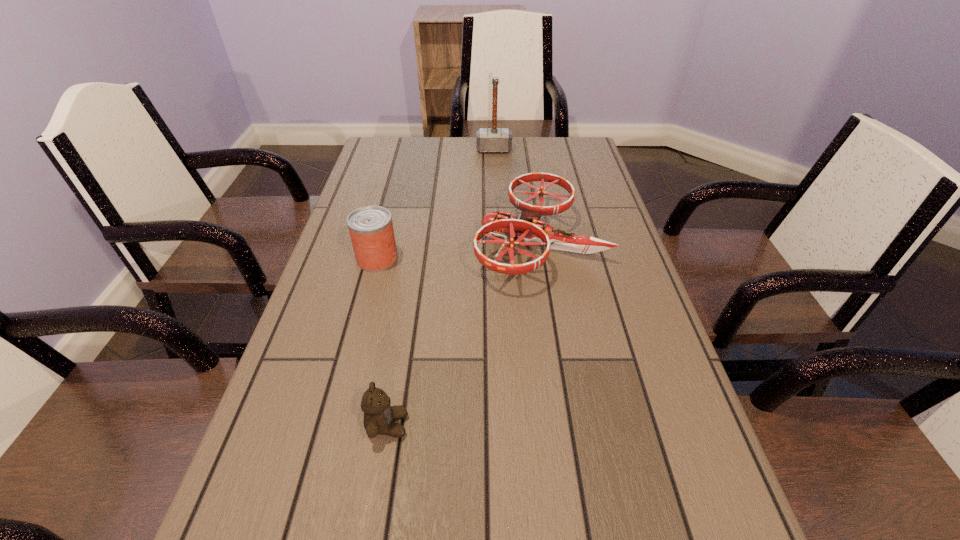
Where is `vacant position in the image that satisfies the following two spatial constraints: 1. on the striking surface of the hammer; 2. on the face of the third object from right to left`? vacant position in the image that satisfies the following two spatial constraints: 1. on the striking surface of the hammer; 2. on the face of the third object from right to left is located at coordinates (507, 425).

Locate an element on the screen. vacant region that satisfies the following two spatial constraints: 1. on the front side of the drone; 2. on the face of the teddy bear is located at coordinates (569, 425).

You are a GUI agent. You are given a task and a screenshot of the screen. Output one action in this format:
    pyautogui.click(x=<x>, y=<y>)
    Task: Click on the free region that satisfies the following two spatial constraints: 1. on the striking surface of the farthest object; 2. on the face of the third object from right to left
    This screenshot has width=960, height=540.
    Given the screenshot: What is the action you would take?
    pyautogui.click(x=507, y=425)

Where is `vacant space that satisfies the following two spatial constraints: 1. on the striking surface of the tallest object; 2. on the face of the third object from right to left`? vacant space that satisfies the following two spatial constraints: 1. on the striking surface of the tallest object; 2. on the face of the third object from right to left is located at coordinates (507, 425).

Where is `vacant area that satisfies the following two spatial constraints: 1. on the striking surface of the tallest object; 2. on the right side of the drone`? This screenshot has width=960, height=540. vacant area that satisfies the following two spatial constraints: 1. on the striking surface of the tallest object; 2. on the right side of the drone is located at coordinates (498, 243).

You are a GUI agent. You are given a task and a screenshot of the screen. Output one action in this format:
    pyautogui.click(x=<x>, y=<y>)
    Task: Click on the vacant space that satisfies the following two spatial constraints: 1. on the striking surface of the farthest object; 2. on the right side of the drone
    This screenshot has height=540, width=960.
    Given the screenshot: What is the action you would take?
    pyautogui.click(x=498, y=243)

Where is `blank space that satisfies the following two spatial constraints: 1. on the striking surface of the tallest object; 2. on the right side of the drone`? The image size is (960, 540). blank space that satisfies the following two spatial constraints: 1. on the striking surface of the tallest object; 2. on the right side of the drone is located at coordinates (498, 243).